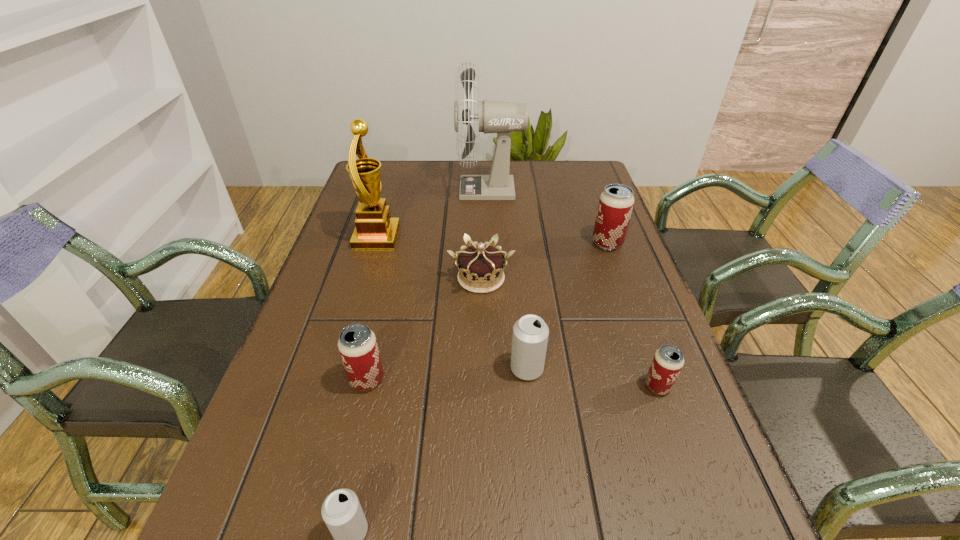
Locate an element on the screen. fan is located at coordinates (499, 117).

The height and width of the screenshot is (540, 960). In order to click on gray fan in this screenshot , I will do coord(499,117).

Identify the location of award. (374, 228).

Where is `the biggest red beer can`? This screenshot has height=540, width=960. the biggest red beer can is located at coordinates (616, 202).

The image size is (960, 540). What are the coordinates of `the third tallest object` in the screenshot? It's located at (616, 202).

Image resolution: width=960 pixels, height=540 pixels. In order to click on the bigger white beer can in this screenshot , I will do `click(530, 333)`.

Identify the location of the farther white beer can. (530, 333).

Locate an element on the screen. This screenshot has height=540, width=960. the second biggest red beer can is located at coordinates pos(357,344).

The width and height of the screenshot is (960, 540). Find the location of `crown`. crown is located at coordinates click(480, 266).

The height and width of the screenshot is (540, 960). Find the location of `gold crown`. gold crown is located at coordinates (480, 266).